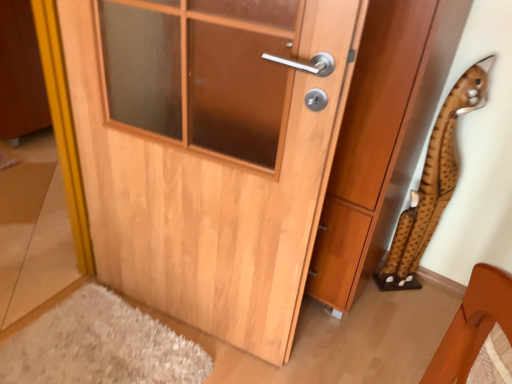
Question: Considering the relative positions of light wood door at center and wooden door at center in the image provided, is light wood door at center in front of wooden door at center?

Choices:
 (A) yes
 (B) no

Answer: (A)

Question: Could you tell me if light wood door at center is facing wooden door at center?

Choices:
 (A) yes
 (B) no

Answer: (A)

Question: Can you confirm if light wood door at center is wider than wooden door at center?

Choices:
 (A) yes
 (B) no

Answer: (B)

Question: Is light wood door at center positioned beyond the bounds of wooden door at center?

Choices:
 (A) yes
 (B) no

Answer: (A)

Question: Is light wood door at center oriented away from wooden door at center?

Choices:
 (A) yes
 (B) no

Answer: (A)

Question: Is brown spotted plush at right bigger or smaller than wooden door at center?

Choices:
 (A) big
 (B) small

Answer: (B)

Question: Considering the positions of brown spotted plush at right and wooden door at center in the image, is brown spotted plush at right taller or shorter than wooden door at center?

Choices:
 (A) short
 (B) tall

Answer: (A)

Question: From the image's perspective, relative to wooden door at center, is brown spotted plush at right above or below?

Choices:
 (A) above
 (B) below

Answer: (B)

Question: Is point (395, 238) positioned closer to the camera than point (373, 71)?

Choices:
 (A) farther
 (B) closer

Answer: (A)

Question: Do you think light wood door at center is within brown spotted plush at right, or outside of it?

Choices:
 (A) inside
 (B) outside

Answer: (B)

Question: Is light wood door at center wider or thinner than brown spotted plush at right?

Choices:
 (A) wide
 (B) thin

Answer: (A)

Question: Looking at the image, does light wood door at center seem bigger or smaller compared to brown spotted plush at right?

Choices:
 (A) small
 (B) big

Answer: (B)

Question: Considering their positions, is light wood door at center located in front of or behind brown spotted plush at right?

Choices:
 (A) front
 (B) behind

Answer: (A)

Question: Visually, is light wood door at center positioned to the left or to the right of wooden door at center?

Choices:
 (A) right
 (B) left

Answer: (B)

Question: From the image's perspective, is light wood door at center positioned above or below wooden door at center?

Choices:
 (A) below
 (B) above

Answer: (A)